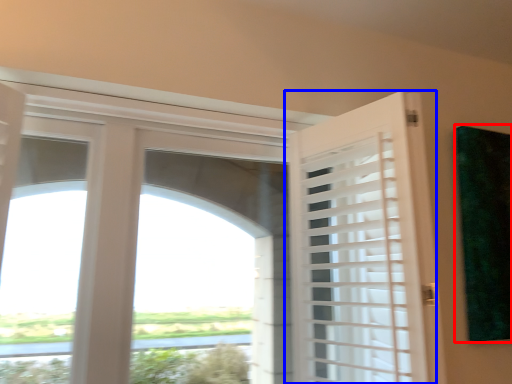
Question: Among these objects, which one is nearest to the camera, window screen (highlighted by a red box) or door (highlighted by a blue box)?

Choices:
 (A) window screen
 (B) door

Answer: (B)